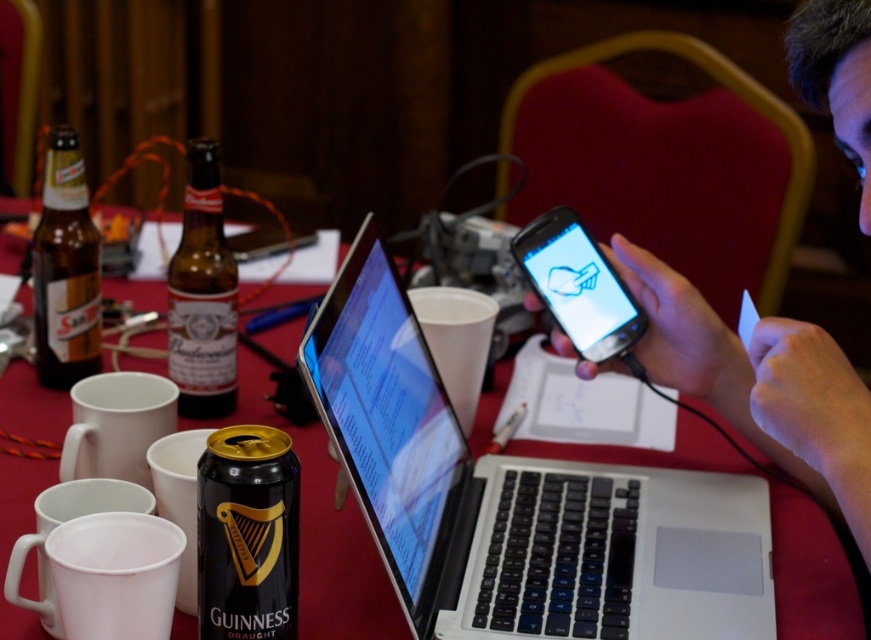
What object is located at the coordinates point (518, 497)?

The silver black laptop at center is located at point (518, 497).

You are organizing a workshop and need to place a matte black phone at center on the table. However, there is a brown glass bottle at left in the way. Can the phone be moved to the right of the bottle without tilting it?

The brown glass bottle at left is thinner than the matte black phone at center, so moving the phone to the right of the bottle may require more space since the phone is wider. Therefore, it might not fit without tilting or rearranging other items.